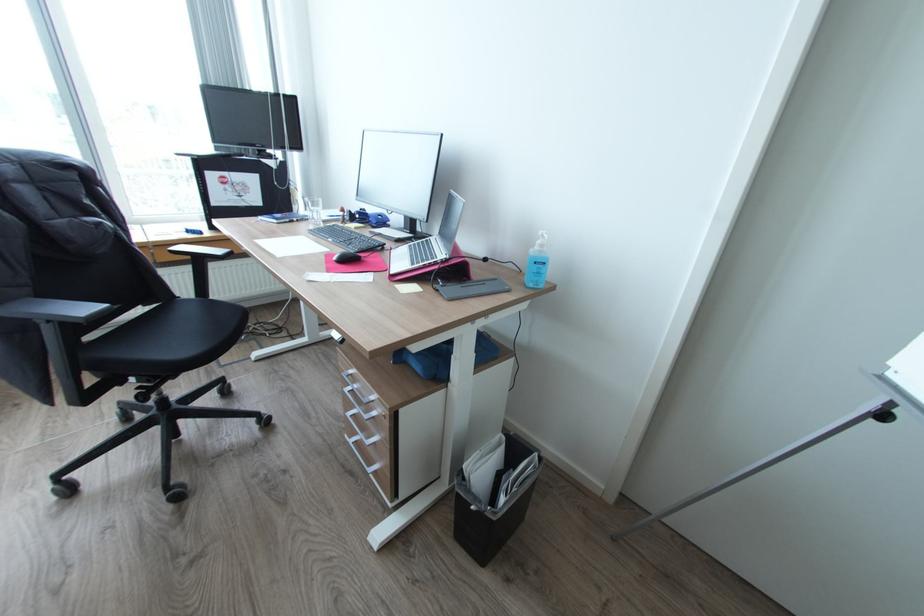
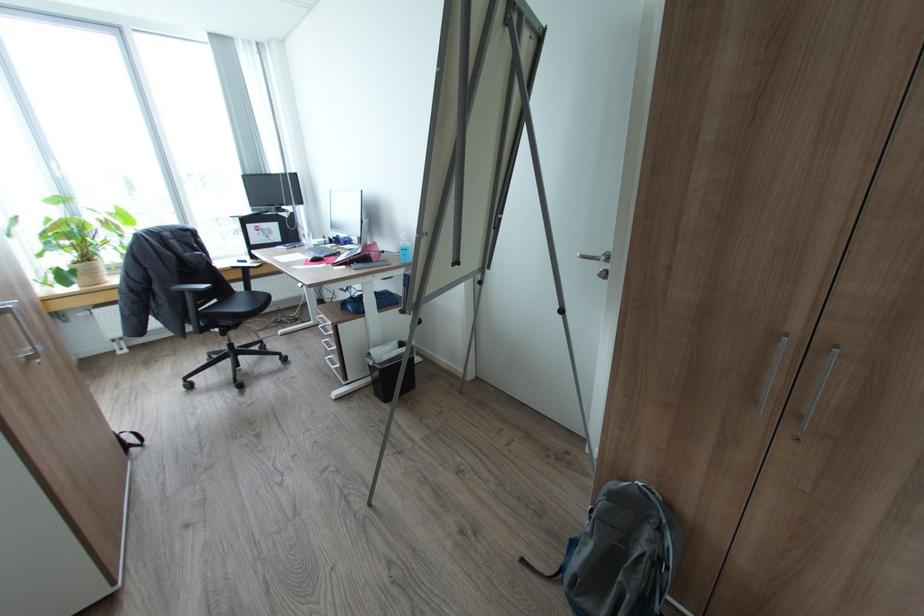
Locate, in the second image, the point that corresponds to point (339, 257) in the first image.

(314, 259)